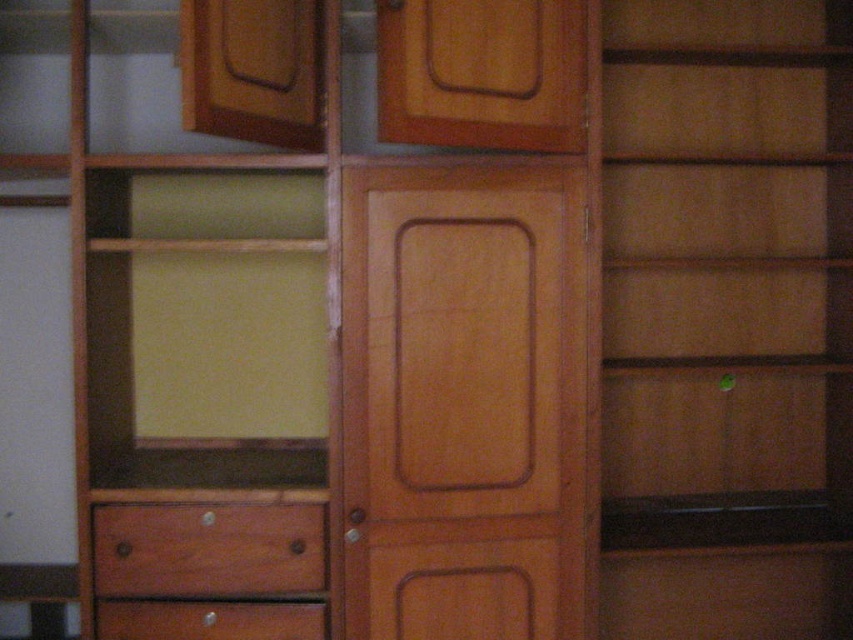
Does brown wood drawer at lower left have a lesser width compared to matte brown drawer at lower left?

No.

Between point (183, 579) and point (138, 614), which one is positioned behind?

Positioned behind is point (138, 614).

The width and height of the screenshot is (853, 640). Find the location of `brown wood drawer at lower left`. brown wood drawer at lower left is located at coordinates (207, 550).

Between matte wood door at center and brown wood drawer at lower left, which one is positioned higher?

matte wood door at center is above.

Does point (544, 312) lie behind point (322, 529)?

Yes, it is.

Identify the location of matte wood door at center. The image size is (853, 640). (463, 403).

Which is in front, point (444, 342) or point (112, 628)?

Point (112, 628)

Is matte wood door at center positioned in front of matte brown drawer at lower left?

Yes, it is.

Between point (457, 497) and point (132, 611), which one is positioned in front?

Point (132, 611) is in front.

The width and height of the screenshot is (853, 640). In order to click on matte wood door at center in this screenshot , I will do `click(463, 403)`.